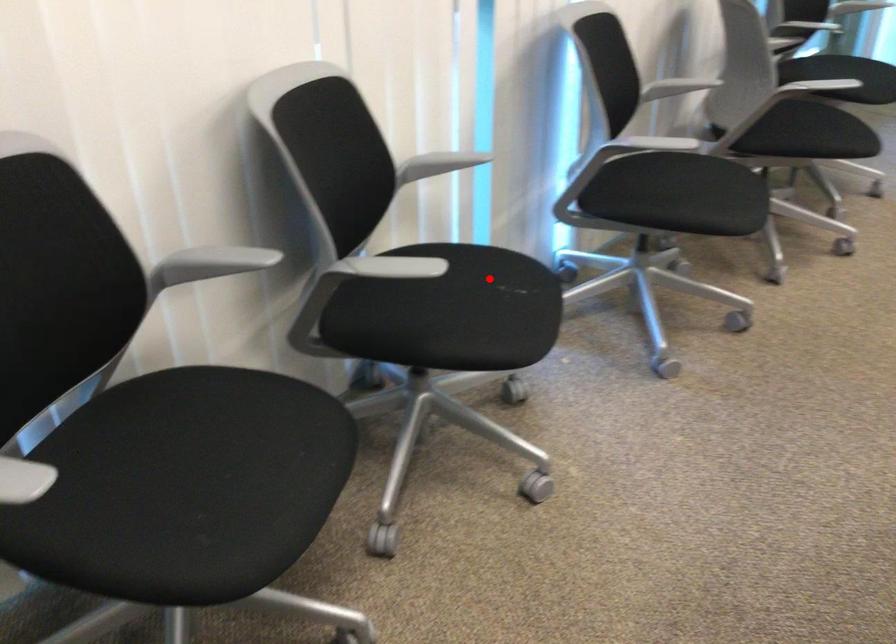
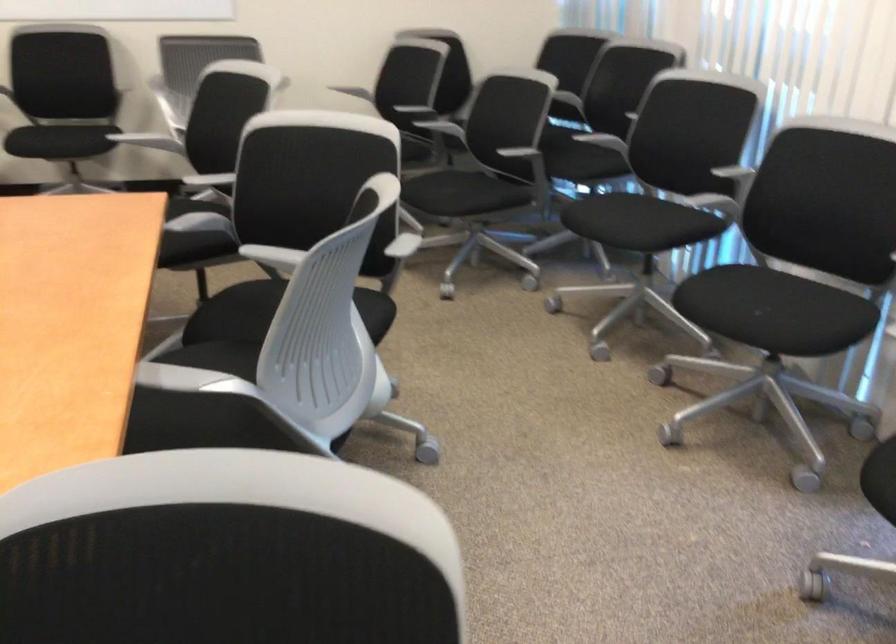
The point at the highlighted location is marked in the first image. Where is the corresponding point in the second image?

(771, 310)